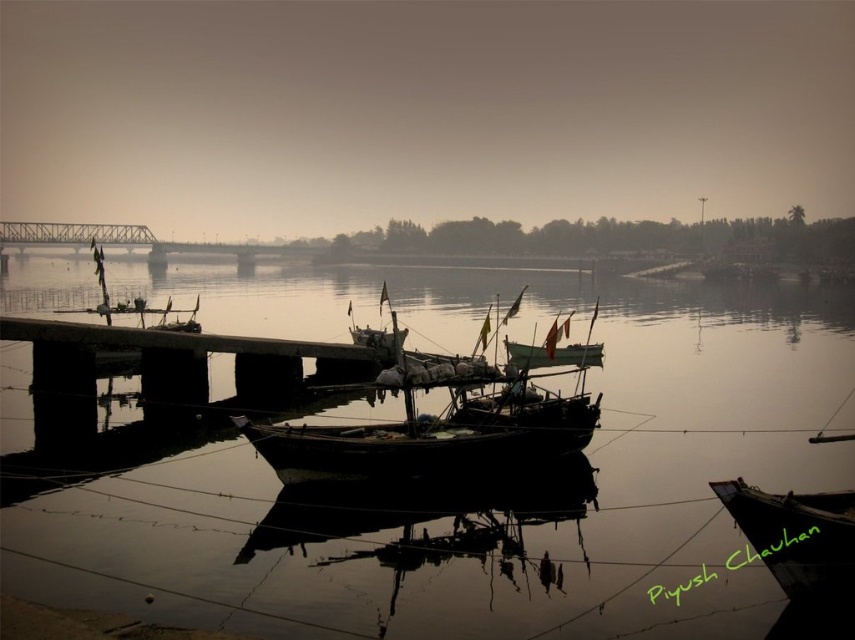
Does dark brown wooden boat at lower right have a lesser height compared to green matte boat at center?

Yes.

Can you confirm if dark brown wooden boat at lower right is taller than green matte boat at center?

No.

Between point (781, 506) and point (514, 362), which one is positioned in front?

Point (781, 506) is in front.

This screenshot has height=640, width=855. In order to click on dark brown wooden boat at lower right in this screenshot , I will do `click(795, 536)`.

Describe the element at coordinates (439, 509) in the screenshot. Image resolution: width=855 pixels, height=640 pixels. I see `brown matte water at center` at that location.

Between point (540, 616) and point (334, 465), which one is positioned in front?

Positioned in front is point (540, 616).

The width and height of the screenshot is (855, 640). In order to click on brown matte water at center in this screenshot , I will do `click(439, 509)`.

Is wooden boat at center further to camera compared to green matte boat at center?

No, it is in front of green matte boat at center.

Does wooden boat at center have a larger size compared to green matte boat at center?

Yes, wooden boat at center is bigger than green matte boat at center.

Find the location of a particular element. Image resolution: width=855 pixels, height=640 pixels. wooden boat at center is located at coordinates (431, 428).

Identify the location of wooden boat at center. This screenshot has width=855, height=640. (431, 428).